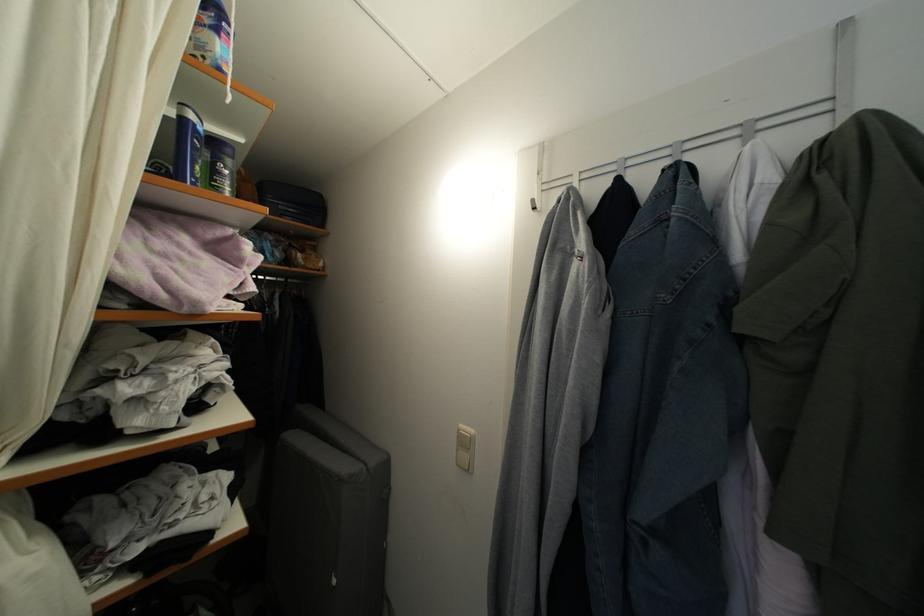
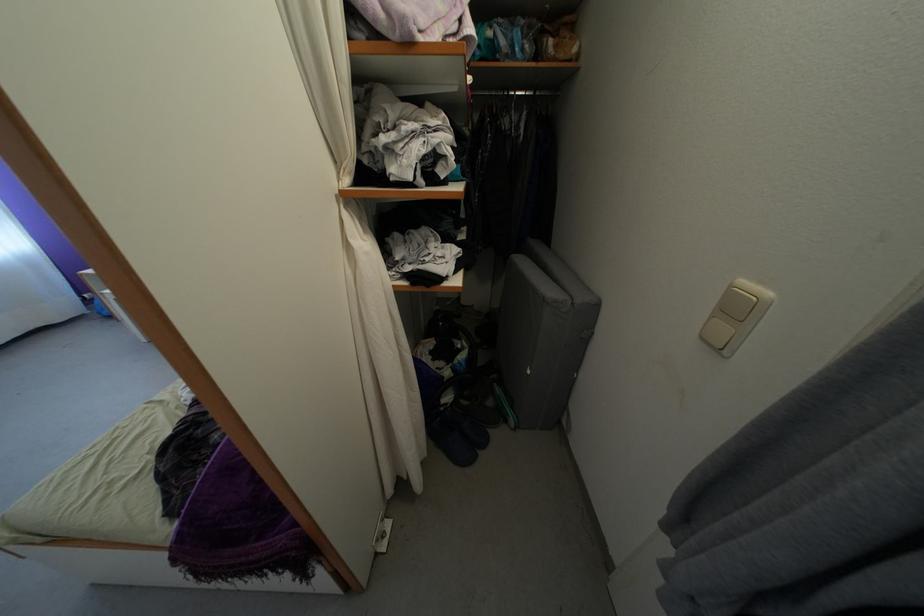
In the second image, find the point that corresponds to (x=339, y=588) in the first image.

(535, 378)